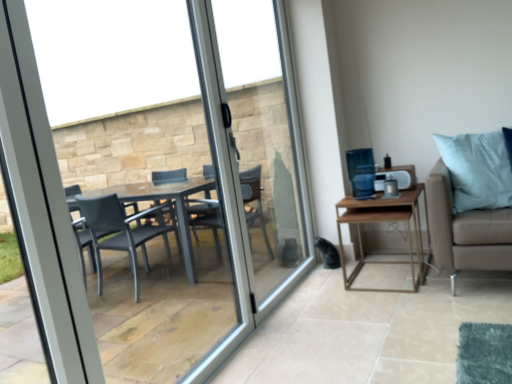
Question: From the image's perspective, would you say clear glass door at center is shown under wooden table at right?

Choices:
 (A) no
 (B) yes

Answer: (A)

Question: Is wooden table at right inside clear glass door at center?

Choices:
 (A) yes
 (B) no

Answer: (B)

Question: Considering the relative sizes of clear glass door at center and wooden table at right in the image provided, is clear glass door at center smaller than wooden table at right?

Choices:
 (A) no
 (B) yes

Answer: (A)

Question: Can you confirm if clear glass door at center is wider than wooden table at right?

Choices:
 (A) no
 (B) yes

Answer: (A)

Question: From a real-world perspective, is clear glass door at center beneath wooden table at right?

Choices:
 (A) no
 (B) yes

Answer: (A)

Question: Is transparent glass window at center inside or outside of clear glass door at center?

Choices:
 (A) inside
 (B) outside

Answer: (B)

Question: From the image's perspective, relative to clear glass door at center, is transparent glass window at center above or below?

Choices:
 (A) below
 (B) above

Answer: (A)

Question: From a real-world perspective, is transparent glass window at center physically located above or below clear glass door at center?

Choices:
 (A) below
 (B) above

Answer: (A)

Question: In the image, is transparent glass window at center on the left side or the right side of clear glass door at center?

Choices:
 (A) left
 (B) right

Answer: (A)

Question: From the image's perspective, is clear glass door at center positioned above or below transparent glass window at center?

Choices:
 (A) above
 (B) below

Answer: (A)

Question: Is clear glass door at center taller or shorter than transparent glass window at center?

Choices:
 (A) tall
 (B) short

Answer: (A)

Question: Is clear glass door at center in front of or behind transparent glass window at center in the image?

Choices:
 (A) behind
 (B) front

Answer: (A)

Question: Do you think clear glass door at center is within transparent glass window at center, or outside of it?

Choices:
 (A) outside
 (B) inside

Answer: (A)

Question: From the image's perspective, is transparent glass window at center above or below wooden table at right?

Choices:
 (A) below
 (B) above

Answer: (B)

Question: Would you say transparent glass window at center is to the left or to the right of wooden table at right in the picture?

Choices:
 (A) left
 (B) right

Answer: (A)